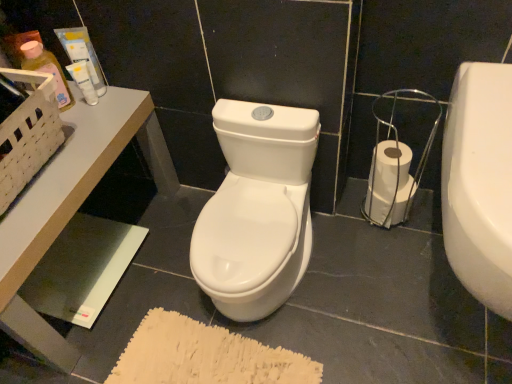
Question: Is translucent plastic bottle at upper left, which appears as the 1th toiletry when viewed from the left, wider or thinner than white glossy toilet paper at lower right?

Choices:
 (A) wide
 (B) thin

Answer: (B)

Question: From the image's perspective, relative to white glossy toilet paper at lower right, is translucent plastic bottle at upper left, which appears as the 1th toiletry when viewed from the left, above or below?

Choices:
 (A) above
 (B) below

Answer: (A)

Question: Which object is positioned farthest from the white glossy table at upper left?

Choices:
 (A) translucent plastic bottle at upper left, which appears as the 1th toiletry when viewed from the left
 (B) matte plastic tube at upper left, the second toiletry when ordered from right to left
 (C) white matte tube at upper left, arranged as the 3th toiletry when viewed from the left
 (D) white glossy toilet paper at lower right

Answer: (D)

Question: Considering the real-world distances, which object is closest to the translucent plastic bottle at upper left, acting as the third toiletry starting from the right?

Choices:
 (A) white glossy table at upper left
 (B) white matte tube at upper left, arranged as the 3th toiletry when viewed from the left
 (C) matte plastic tube at upper left, the second toiletry when ordered from right to left
 (D) white glossy toilet paper at lower right

Answer: (B)